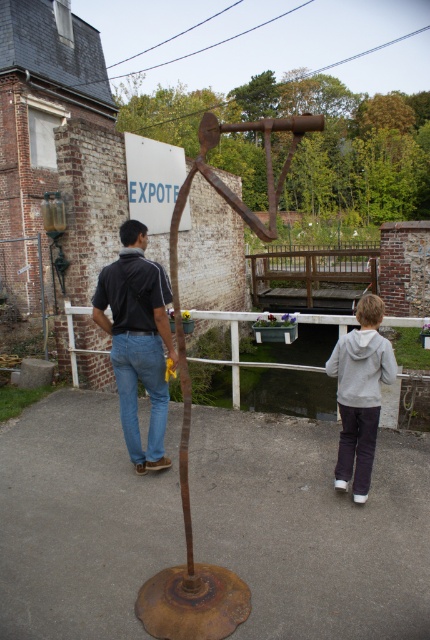
Between rusty metal sculpture at center and brown wooden rail at center, which one appears on the right side from the viewer's perspective?

brown wooden rail at center is more to the right.

Between point (189, 636) and point (297, 300), which one is positioned in front?

Point (189, 636) is in front.

Is point (190, 600) in front of point (359, 291)?

Yes, it is.

You are a GUI agent. You are given a task and a screenshot of the screen. Output one action in this format:
    pyautogui.click(x=<x>, y=<y>)
    Task: Click on the rusty metal sculpture at center
    Image resolution: width=430 pixels, height=640 pixels.
    Given the screenshot: What is the action you would take?
    pyautogui.click(x=190, y=420)

Identify the location of denim jeans at center. Image resolution: width=430 pixels, height=640 pixels. (138, 339).

Is denim jeans at center to the right of blue denim jeans at center from the viewer's perspective?

Yes, denim jeans at center is to the right of blue denim jeans at center.

Measure the distance between denim jeans at center and camera.

denim jeans at center and camera are 13.35 feet apart from each other.

This screenshot has height=640, width=430. I want to click on denim jeans at center, so click(138, 339).

Does rusty metal sculpture at center have a larger size compared to white wooden rail at center?

Correct, rusty metal sculpture at center is larger in size than white wooden rail at center.

Does rusty metal sculpture at center appear on the left side of white wooden rail at center?

No, rusty metal sculpture at center is not to the left of white wooden rail at center.

Measure the distance between point (172, 593) and camera.

The distance of point (172, 593) from camera is 9.92 feet.

Image resolution: width=430 pixels, height=640 pixels. What are the coordinates of `rusty metal sculpture at center` in the screenshot? It's located at (190, 420).